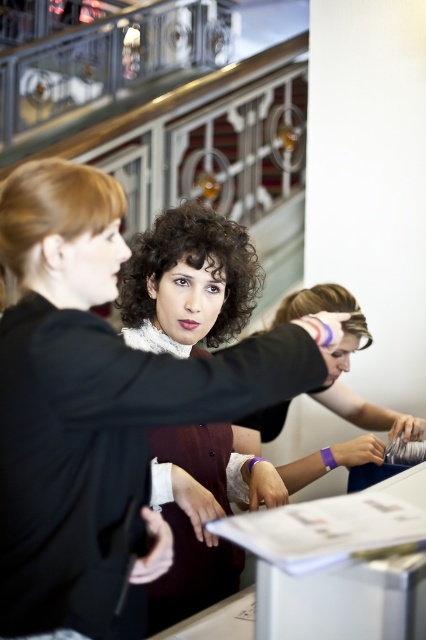
You are standing at the event and want to reach the counter where the two people are interacting. The point you need to reach is marked as point (230,584). If your average walking distance is 3 feet per second, how many seconds will it take you to reach that point?

The distance between you and point (230,584) is 4.75 feet. At a walking speed of 3 feet per second, it will take approximately 1.58 seconds to reach the point.

You are at a reception desk and see two points marked on the floor. The first point is at coordinate point[170,477] and the second is at point[388,422]. Which point is closer to the reception desk?

Point[170,477] is in front of point[388,422], so it is closer to the reception desk.

You are a photographer at the event and need to capture a clear shot of both the matte black hair at center and the curly brown hair at center. Which hairstyle should you focus on first to ensure it appears larger in the photo?

The matte black hair at center is larger in size than the curly brown hair at center, so you should focus on capturing the matte black hair at center first to ensure its larger size is clearly visible in the photo.